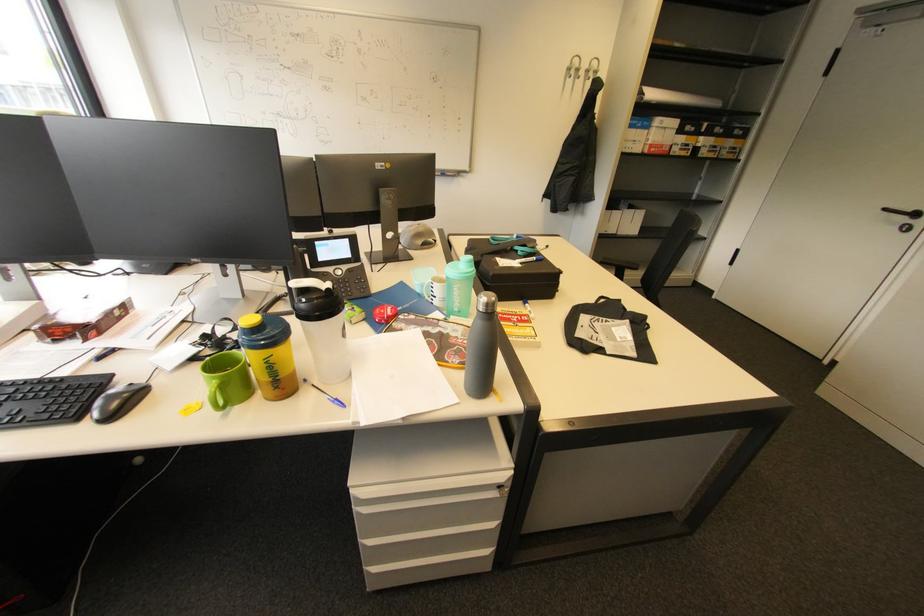
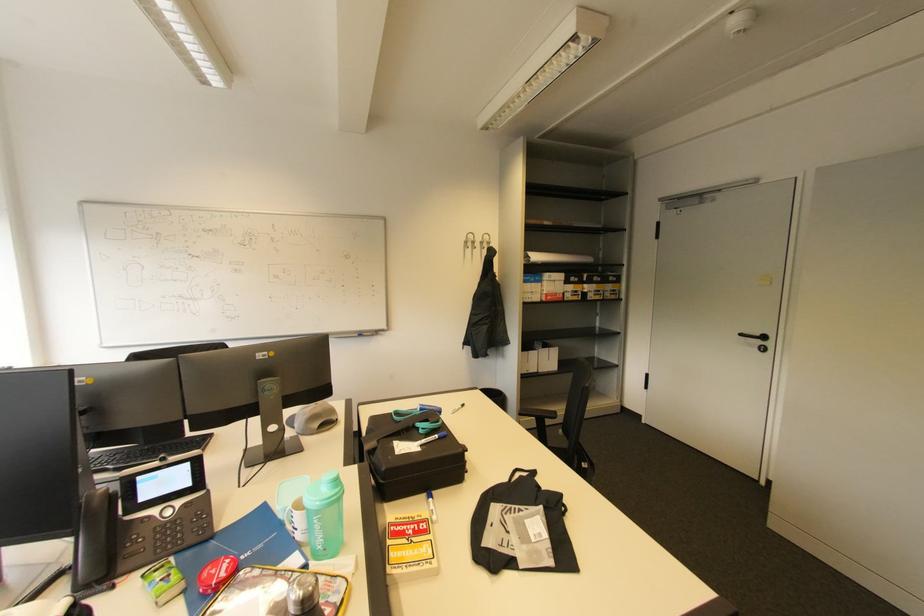
Where in the second image is the point corresponding to (x=526, y=302) from the first image?

(429, 496)